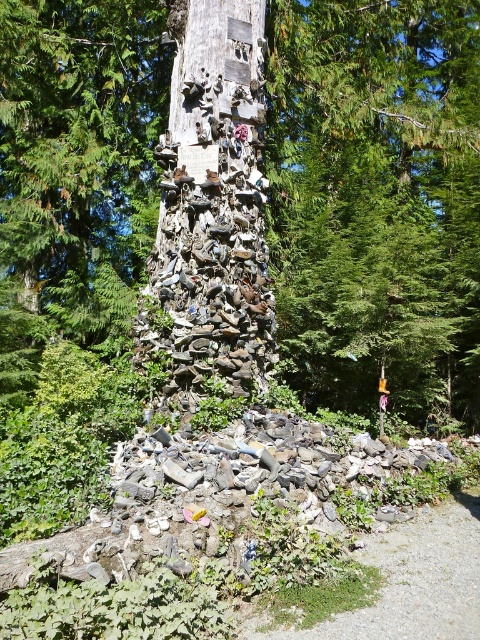
Which is in front, point (61, 292) or point (177, 275)?

Point (177, 275) is in front.

Is point (411, 276) positioned after point (170, 118)?

Yes, point (411, 276) is behind point (170, 118).

The image size is (480, 640). What do you see at coordinates (376, 200) in the screenshot?
I see `wooden shoe at center` at bounding box center [376, 200].

Find the location of `wooden shoe at center`. wooden shoe at center is located at coordinates (376, 200).